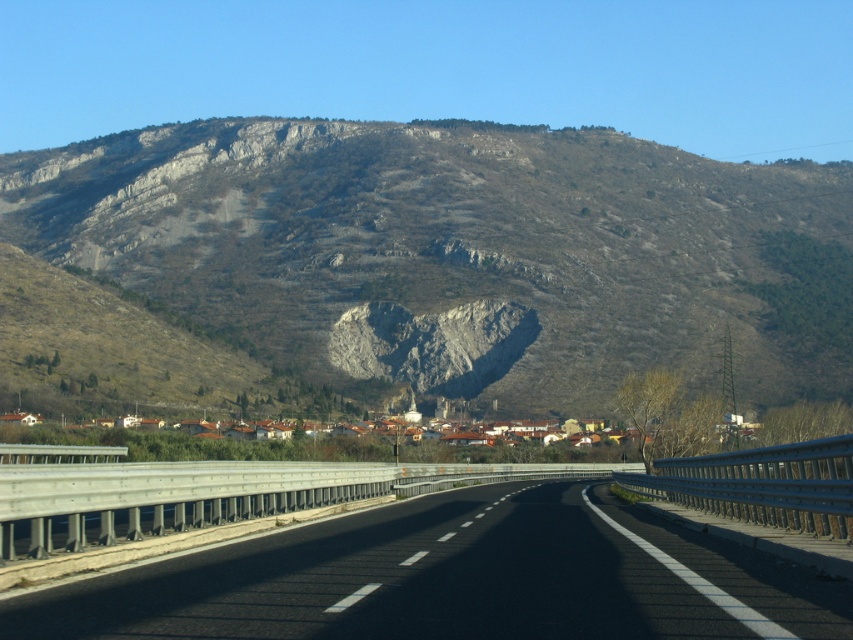
You are standing on the highway and see two points marked on the road ahead. The first point is at coordinate point (828, 381) and the second is at point (804, 586). Which point is closer to you as you stand on the highway?

Point (828, 381) is closer to you than point (804, 586) because it is further to the viewer.

You are standing at the starting point of the highway and looking towards the town. Which direction should you look to see the gray rocky mountain at center?

The gray rocky mountain at center is located at point (462, 252), so you should look towards the center of the image to see it.

You are a photographer planning to capture the gray rocky mountain at center and the black asphalt highway at center in a single shot. Given that the mountain is much taller than the highway, which object will occupy more vertical space in your photo?

The gray rocky mountain at center will occupy more vertical space in the photo since it is much taller than the black asphalt highway at center.